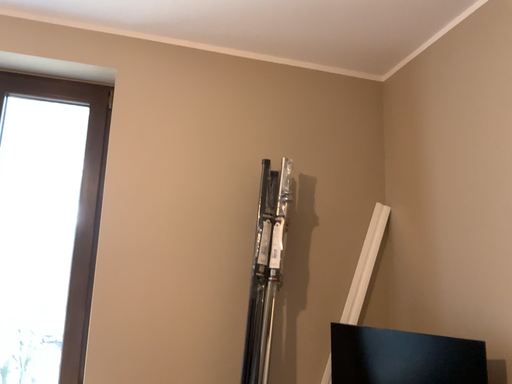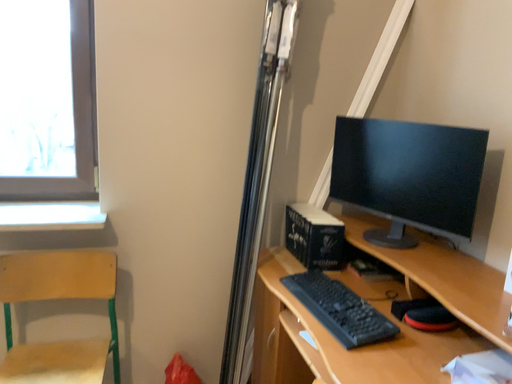
Question: How did the camera likely rotate when shooting the video?

Choices:
 (A) rotated downward
 (B) rotated upward

Answer: (A)